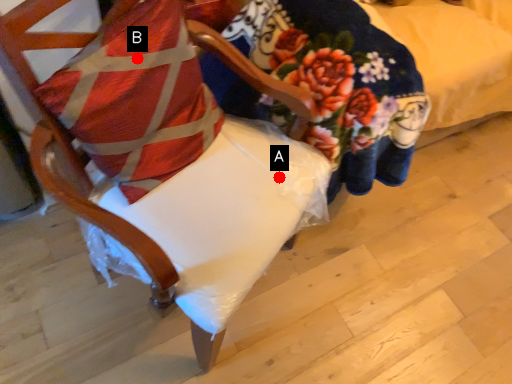
Question: Two points are circled on the image, labeled by A and B beside each circle. Which point appears farthest from the camera in this image?

Choices:
 (A) A is further
 (B) B is further

Answer: (A)